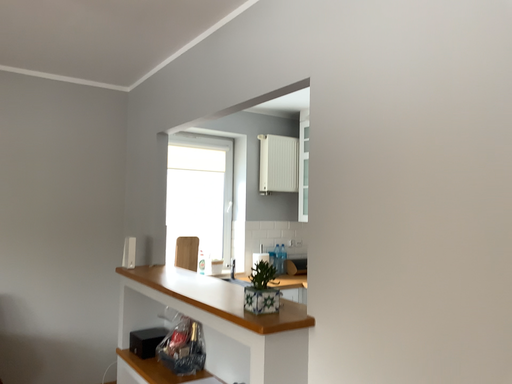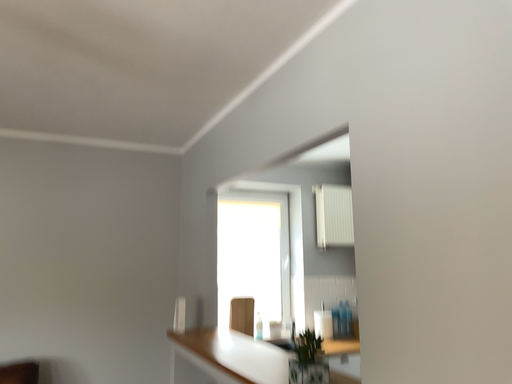
Question: How did the camera likely rotate when shooting the video?

Choices:
 (A) rotated downward
 (B) rotated upward

Answer: (B)